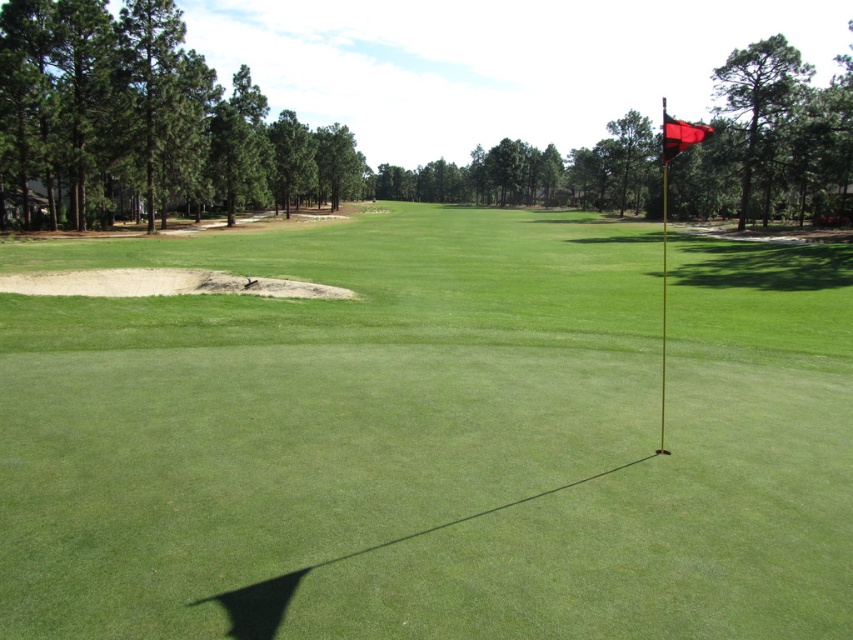
You are a golfer standing on the putting green and want to putt your ball towards the hole marked by the flags. Which flag should you aim for, the green turf flag at right or the red fabric flag at upper right?

You should aim for the green turf flag at right because it is positioned on the left side of the red fabric flag at upper right, meaning it is closer to your current position on the putting green.

You are standing on the golf course and want to hit a ball to the hole marked by the red flag. There are two points on the green at coordinates point (721, 497) and point (662, 136). Which point is closer to you as you stand at the starting position?

Point (721, 497) is closer to the camera than point (662, 136), so the ball at point (721, 497) is closer to you.

You are a golfer who needs to place a new flag on the green. You have two options available to you. The green turf flag at right and the red fabric flag at upper right. Which flag is thinner so that it can be placed in the narrowest part of the green?

The green turf flag at right is thinner than the red fabric flag at upper right, so it can be placed in the narrowest part of the green.